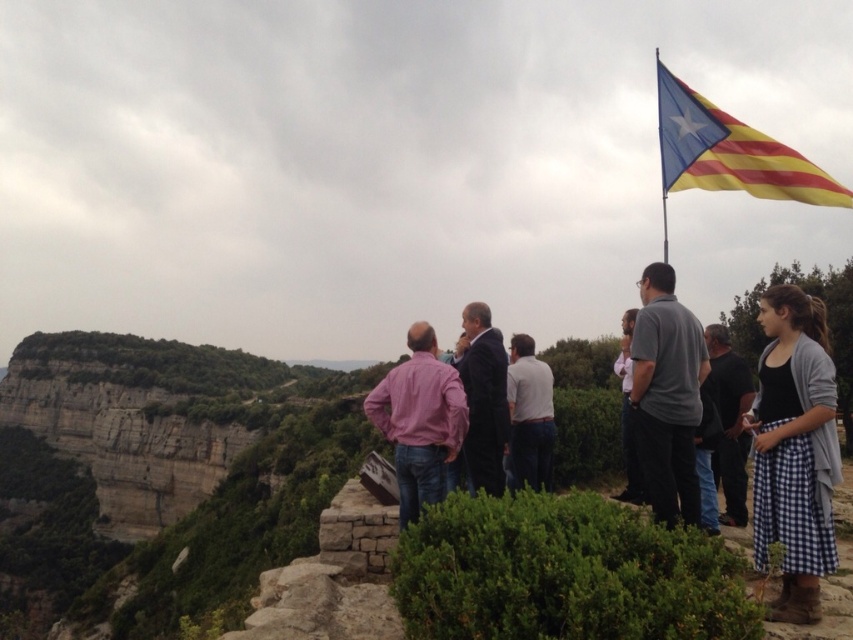
How much distance is there between gray fabric shirt at center-right and white cotton shirt at center?

gray fabric shirt at center-right is 24.65 feet away from white cotton shirt at center.

Between gray fabric shirt at center-right and white cotton shirt at center, which one appears on the left side from the viewer's perspective?

Positioned to the left is white cotton shirt at center.

Is point (645, 280) positioned before point (538, 480)?

Yes, it is in front of point (538, 480).

Where is `gray fabric shirt at center-right`? The image size is (853, 640). gray fabric shirt at center-right is located at coordinates (x=666, y=396).

Does pink shirt at center have a lesser width compared to dark blue suit at center?

In fact, pink shirt at center might be wider than dark blue suit at center.

Which of these two, pink shirt at center or dark blue suit at center, stands shorter?

pink shirt at center is shorter.

From the picture: Measure the distance between point (430, 481) and camera.

The distance of point (430, 481) from camera is 41.74 meters.

The image size is (853, 640). I want to click on pink shirt at center, so point(419,420).

Between yellow striped fabric at upper right and pink shirt at center, which one is positioned higher?

yellow striped fabric at upper right is higher up.

Who is lower down, yellow striped fabric at upper right or pink shirt at center?

pink shirt at center is below.

The height and width of the screenshot is (640, 853). What do you see at coordinates (730, 152) in the screenshot?
I see `yellow striped fabric at upper right` at bounding box center [730, 152].

You are a GUI agent. You are given a task and a screenshot of the screen. Output one action in this format:
    pyautogui.click(x=<x>, y=<y>)
    Task: Click on the yellow striped fabric at upper right
    
    Given the screenshot: What is the action you would take?
    pyautogui.click(x=730, y=152)